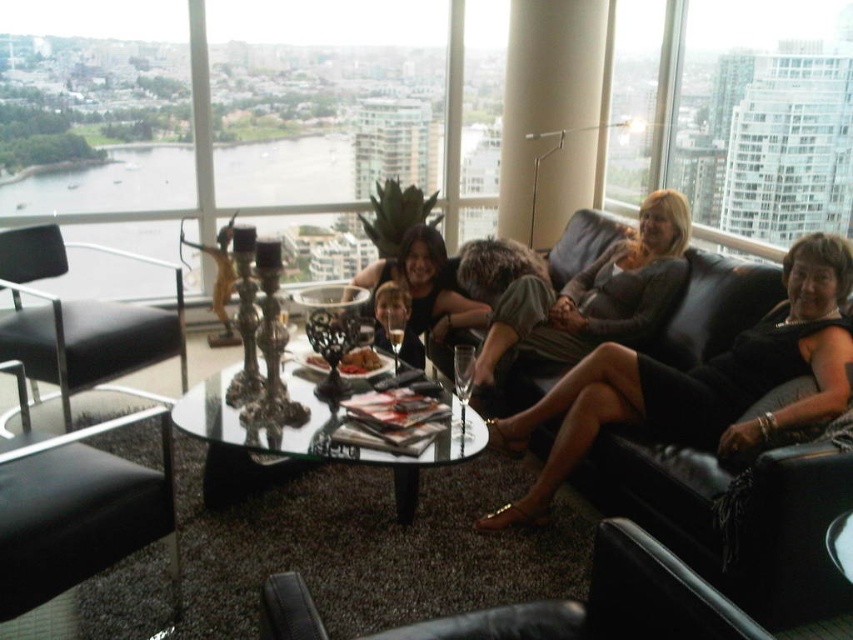
Question: Where is black leather armchair at left located in relation to matte black dress at center in the image?

Choices:
 (A) left
 (B) right

Answer: (A)

Question: Can you confirm if black leather armchair at lower center is bigger than black leather armchair at left?

Choices:
 (A) yes
 (B) no

Answer: (B)

Question: Does black leather dress at right appear over white glossy pole at upper center?

Choices:
 (A) yes
 (B) no

Answer: (B)

Question: Among these points, which one is nearest to the camera?

Choices:
 (A) (730, 440)
 (B) (183, 364)

Answer: (A)

Question: Which point is farther to the camera?

Choices:
 (A) (817, 266)
 (B) (38, 336)
 (C) (64, 461)

Answer: (B)

Question: Which of these objects is positioned closest to the black leather dress at right?

Choices:
 (A) black leather armchair at lower left
 (B) black leather armchair at lower center

Answer: (B)